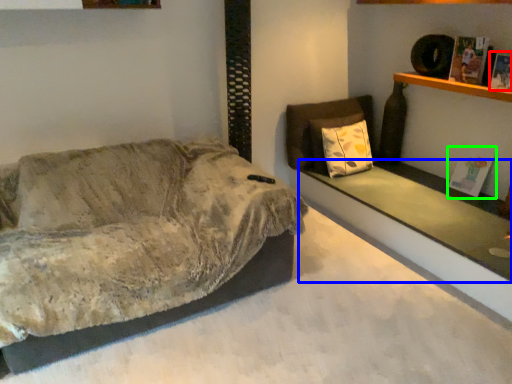
Question: Based on their relative distances, which object is farther from magazine (highlighted by a red box)? Choose from ledge (highlighted by a blue box) and magazine (highlighted by a green box).

Choices:
 (A) ledge
 (B) magazine

Answer: (A)